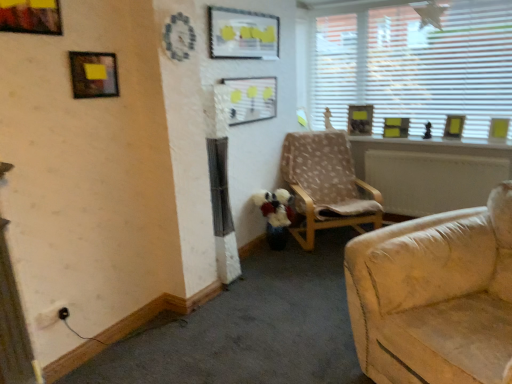
Measure the distance between point (449, 105) and camera.

Point (449, 105) is 3.79 meters from camera.

This screenshot has height=384, width=512. What do you see at coordinates (326, 185) in the screenshot? I see `light brown fabric chair at center` at bounding box center [326, 185].

The image size is (512, 384). Describe the element at coordinates (52, 315) in the screenshot. I see `black plastic electric outlet at lower left` at that location.

The width and height of the screenshot is (512, 384). Describe the element at coordinates (396, 127) in the screenshot. I see `yellow matte picture frame at upper right, which ranks as the 3th picture frame in right-to-left order` at that location.

This screenshot has height=384, width=512. Identify the location of matte plastic picture frame at upper center, acting as the third picture frame starting from the front. (243, 34).

At what (x,y) coordinates should I click in order to perform the action: click on metallic gold picture frame at upper left, which is the 1th picture frame from front to back. Please return your answer as a coordinate pair (x, y). Looking at the image, I should click on (30, 16).

Relative to yellow matte picture frame at upper right, marked as the 6th picture frame in a left-to-right arrangement, is wooden picture frame at upper right, the 6th picture frame from the front, in front or behind?

wooden picture frame at upper right, the 6th picture frame from the front, is in front of yellow matte picture frame at upper right, marked as the 6th picture frame in a left-to-right arrangement.

Consider the image. How distant is wooden picture frame at upper right, the second picture frame viewed from the right, from yellow matte picture frame at upper right, the 2th picture frame in the back-to-front sequence?

wooden picture frame at upper right, the second picture frame viewed from the right, and yellow matte picture frame at upper right, the 2th picture frame in the back-to-front sequence, are 16.80 inches apart from each other.

Which object is thinner, wooden picture frame at upper right, the 3th picture frame when ordered from back to front, or yellow matte picture frame at upper right, which ranks as the 3th picture frame in right-to-left order?

wooden picture frame at upper right, the 3th picture frame when ordered from back to front.

Could yellow matte picture frame at upper right, the 2th picture frame in the back-to-front sequence, be considered to be inside wooden picture frame at upper right, the second picture frame viewed from the right?

No.

Considering the relative positions of matte plastic picture frame at center, which is the fifth picture frame in right-to-left order, and black plastic electric outlet at lower left in the image provided, is matte plastic picture frame at center, which is the fifth picture frame in right-to-left order, in front of black plastic electric outlet at lower left?

That is False.

Would you say matte plastic picture frame at center, which is the fifth picture frame in right-to-left order, is inside or outside black plastic electric outlet at lower left?

matte plastic picture frame at center, which is the fifth picture frame in right-to-left order, exists outside the volume of black plastic electric outlet at lower left.

Considering the relative sizes of matte plastic picture frame at center, positioned as the 4th picture frame in front-to-back order, and black plastic electric outlet at lower left in the image provided, is matte plastic picture frame at center, positioned as the 4th picture frame in front-to-back order, shorter than black plastic electric outlet at lower left?

Incorrect, the height of matte plastic picture frame at center, positioned as the 4th picture frame in front-to-back order, does not fall short of that of black plastic electric outlet at lower left.

From a real-world perspective, between matte plastic picture frame at center, which is the fourth picture frame in left-to-right order, and black plastic electric outlet at lower left, who is vertically higher?

From a 3D spatial view, matte plastic picture frame at center, which is the fourth picture frame in left-to-right order, is above.

Is point (39, 314) closer or farther from the camera than point (256, 46)?

Point (39, 314) is closer to the camera than point (256, 46).

Does black plastic electric outlet at lower left lie in front of matte plastic picture frame at upper center, placed as the third picture frame when sorted from left to right?

Yes, the depth of black plastic electric outlet at lower left is less than that of matte plastic picture frame at upper center, placed as the third picture frame when sorted from left to right.

Between black plastic electric outlet at lower left and matte plastic picture frame at upper center, acting as the third picture frame starting from the front, which one has larger size?

matte plastic picture frame at upper center, acting as the third picture frame starting from the front.

Between black plastic electric outlet at lower left and yellow matte picture frame at upper right, marked as the 6th picture frame in a left-to-right arrangement, which one is positioned behind?

yellow matte picture frame at upper right, marked as the 6th picture frame in a left-to-right arrangement, is behind.

Considering the relative positions of black plastic electric outlet at lower left and yellow matte picture frame at upper right, which ranks as the 3th picture frame in right-to-left order, in the image provided, is black plastic electric outlet at lower left to the left of yellow matte picture frame at upper right, which ranks as the 3th picture frame in right-to-left order, from the viewer's perspective?

Indeed, black plastic electric outlet at lower left is positioned on the left side of yellow matte picture frame at upper right, which ranks as the 3th picture frame in right-to-left order.

Does black plastic electric outlet at lower left touch yellow matte picture frame at upper right, the seventh picture frame from the front?

No, black plastic electric outlet at lower left is not next to yellow matte picture frame at upper right, the seventh picture frame from the front.

From a real-world perspective, is black plastic electric outlet at lower left positioned over yellow matte picture frame at upper right, the seventh picture frame from the front, based on gravity?

No.

Relative to metallic gold picture frame at upper left, marked as the 1th picture frame in a left-to-right arrangement, is matte plastic picture frame at center, positioned as the 4th picture frame in front-to-back order, in front or behind?

matte plastic picture frame at center, positioned as the 4th picture frame in front-to-back order, is positioned farther from the viewer than metallic gold picture frame at upper left, marked as the 1th picture frame in a left-to-right arrangement.

Is the surface of matte plastic picture frame at center, positioned as the 4th picture frame in front-to-back order, in direct contact with metallic gold picture frame at upper left, which is counted as the 8th picture frame, starting from the back?

No, matte plastic picture frame at center, positioned as the 4th picture frame in front-to-back order, is not with metallic gold picture frame at upper left, which is counted as the 8th picture frame, starting from the back.

Does matte plastic picture frame at center, positioned as the 4th picture frame in front-to-back order, appear on the right side of metallic gold picture frame at upper left, which is counted as the 8th picture frame, starting from the back?

Indeed, matte plastic picture frame at center, positioned as the 4th picture frame in front-to-back order, is positioned on the right side of metallic gold picture frame at upper left, which is counted as the 8th picture frame, starting from the back.

From the image's perspective, relative to metallic gold picture frame at upper left, marked as the 1th picture frame in a left-to-right arrangement, is matte plastic picture frame at center, positioned as the 4th picture frame in front-to-back order, above or below?

Based on their image positions, matte plastic picture frame at center, positioned as the 4th picture frame in front-to-back order, is located beneath metallic gold picture frame at upper left, marked as the 1th picture frame in a left-to-right arrangement.

Can you confirm if yellow paper picture frame at upper right, positioned as the 8th picture frame in left-to-right order, is shorter than wooden picture frame at upper right, marked as the 7th picture frame in a left-to-right arrangement?

Indeed, yellow paper picture frame at upper right, positioned as the 8th picture frame in left-to-right order, has a lesser height compared to wooden picture frame at upper right, marked as the 7th picture frame in a left-to-right arrangement.

How many degrees apart are the facing directions of yellow paper picture frame at upper right, positioned as the 8th picture frame in left-to-right order, and wooden picture frame at upper right, the 6th picture frame from the front?

The facing directions of yellow paper picture frame at upper right, positioned as the 8th picture frame in left-to-right order, and wooden picture frame at upper right, the 6th picture frame from the front, are 13.9 degrees apart.

From the picture: In the image, is yellow paper picture frame at upper right, which is the fourth picture frame in back-to-front order, on the left side or the right side of wooden picture frame at upper right, the second picture frame viewed from the right?

yellow paper picture frame at upper right, which is the fourth picture frame in back-to-front order, is to the right of wooden picture frame at upper right, the second picture frame viewed from the right.

In the scene shown: Can you confirm if wooden picture frame at upper right, acting as the 4th picture frame starting from the right, is thinner than light brown fabric chair at center?

Correct, the width of wooden picture frame at upper right, acting as the 4th picture frame starting from the right, is less than that of light brown fabric chair at center.

Is wooden picture frame at upper right, the 5th picture frame viewed from the left, not near light brown fabric chair at center?

wooden picture frame at upper right, the 5th picture frame viewed from the left, is near light brown fabric chair at center, not far away.

Is wooden picture frame at upper right, marked as the 1th picture frame in a back-to-front arrangement, at the left side of light brown fabric chair at center?

No, wooden picture frame at upper right, marked as the 1th picture frame in a back-to-front arrangement, is not to the left of light brown fabric chair at center.

Does point (355, 105) appear closer or farther from the camera than point (359, 180)?

Point (355, 105) is positioned farther from the camera compared to point (359, 180).

From a real-world perspective, which picture frame is the 1st one underneath the wooden picture frame at upper right, the 6th picture frame from the front? Please provide its 2D coordinates.

[(396, 127)]

Locate an element on the screen. This screenshot has height=384, width=512. electric outlet that is in front of the matte plastic picture frame at center, which is the fourth picture frame in left-to-right order is located at coordinates (52, 315).

Estimate the real-world distances between objects in this image. Which object is further from wooden picture frame at upper right, acting as the 4th picture frame starting from the right, yellow matte picture frame at upper right, the 2th picture frame in the back-to-front sequence, or light brown fabric chair at center?

Based on the image, light brown fabric chair at center appears to be further to wooden picture frame at upper right, acting as the 4th picture frame starting from the right.

Based on their spatial positions, is yellow matte picture frame at upper right, the seventh picture frame from the front, or matte plastic picture frame at upper center, which is counted as the 6th picture frame, starting from the back, closer to wooden picture frame at upper right, the 5th picture frame viewed from the left?

Based on the image, yellow matte picture frame at upper right, the seventh picture frame from the front, appears to be nearer to wooden picture frame at upper right, the 5th picture frame viewed from the left.

Based on their spatial positions, is matte plastic picture frame at upper center, which is the 6th picture frame in right-to-left order, or yellow matte picture frame at upper right, which ranks as the 3th picture frame in right-to-left order, closer to black plastic electric outlet at lower left?

The object closer to black plastic electric outlet at lower left is matte plastic picture frame at upper center, which is the 6th picture frame in right-to-left order.

In the scene shown: Looking at the image, which one is located further to matte black picture frame at upper left, which ranks as the 2th picture frame in front-to-back order, yellow paper picture frame at upper right, which is the fourth picture frame in back-to-front order, or white blinds at upper right?

yellow paper picture frame at upper right, which is the fourth picture frame in back-to-front order, is further to matte black picture frame at upper left, which ranks as the 2th picture frame in front-to-back order.

Which object lies nearer to the anchor point yellow paper picture frame at upper right, which is the first picture frame in right-to-left order, light brown fabric chair at center or matte plastic picture frame at center, which is the fifth picture frame in right-to-left order?

Among the two, light brown fabric chair at center is located nearer to yellow paper picture frame at upper right, which is the first picture frame in right-to-left order.

Based on their spatial positions, is wooden picture frame at upper right, marked as the 7th picture frame in a left-to-right arrangement, or yellow paper picture frame at upper right, acting as the fifth picture frame starting from the front, further from matte plastic picture frame at upper center, which is counted as the 6th picture frame, starting from the back?

The object further to matte plastic picture frame at upper center, which is counted as the 6th picture frame, starting from the back, is yellow paper picture frame at upper right, acting as the fifth picture frame starting from the front.

Considering their positions, is white blinds at upper right positioned further to metallic gold picture frame at upper left, which is the 1th picture frame from front to back, than black plastic electric outlet at lower left?

white blinds at upper right.

Based on their spatial positions, is yellow paper picture frame at upper right, acting as the fifth picture frame starting from the front, or light brown fabric chair at center further from white blinds at upper right?

Based on the image, light brown fabric chair at center appears to be further to white blinds at upper right.

At what (x,y) coordinates should I click in order to perform the action: click on chair located between matte plastic picture frame at upper center, which is counted as the 6th picture frame, starting from the back, and yellow paper picture frame at upper right, acting as the fifth picture frame starting from the front, in the left-right direction. Please return your answer as a coordinate pair (x, y). Looking at the image, I should click on (326, 185).

I want to click on chair between matte plastic picture frame at center, which is the fifth picture frame in right-to-left order, and yellow paper picture frame at upper right, acting as the fifth picture frame starting from the front, in the horizontal direction, so click(326, 185).

This screenshot has height=384, width=512. I want to click on chair between metallic gold picture frame at upper left, which is counted as the 8th picture frame, starting from the back, and wooden picture frame at upper right, the second picture frame viewed from the right, so click(326, 185).

Locate an element on the screen. This screenshot has width=512, height=384. picture frame positioned between matte black picture frame at upper left, the 7th picture frame positioned from the right, and matte plastic picture frame at center, marked as the 5th picture frame in a back-to-front arrangement, from near to far is located at coordinates [x=243, y=34].